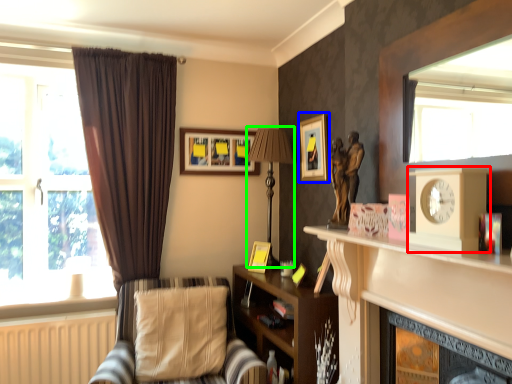
Question: Considering the real-world distances, which object is farthest from clock (highlighted by a red box)? picture frame (highlighted by a blue box) or lamp (highlighted by a green box)?

Choices:
 (A) picture frame
 (B) lamp

Answer: (B)